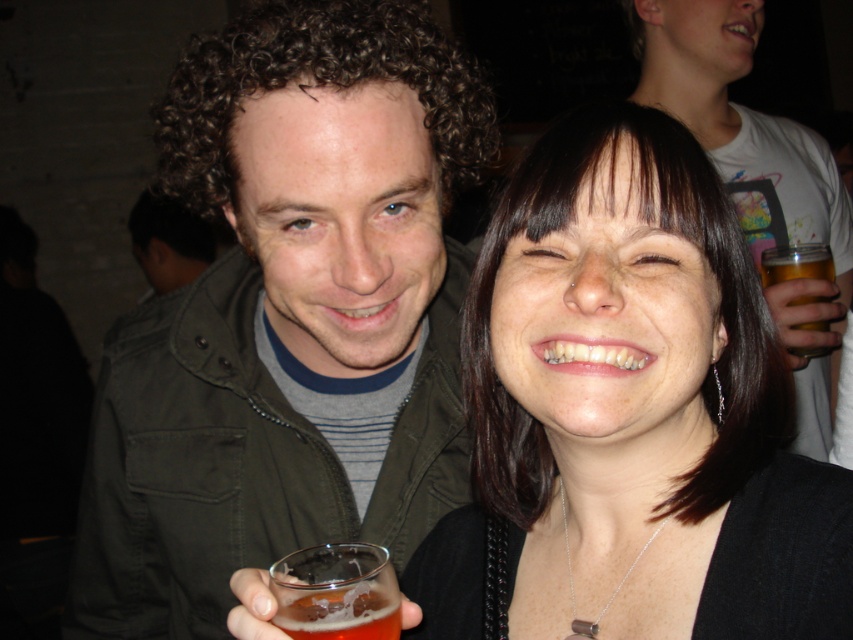
Question: Is matte gray jacket at center to the right of golden amber liquid at upper right from the viewer's perspective?

Choices:
 (A) yes
 (B) no

Answer: (A)

Question: Which point appears farthest from the camera in this image?

Choices:
 (A) (485, 413)
 (B) (136, 573)
 (C) (790, 272)

Answer: (C)

Question: Does matte green jacket at center have a greater width compared to translucent glass at lower center?

Choices:
 (A) yes
 (B) no

Answer: (A)

Question: Does matte green jacket at center have a smaller size compared to matte black hair at center?

Choices:
 (A) no
 (B) yes

Answer: (A)

Question: Which of the following is the farthest from the observer?

Choices:
 (A) matte black hair at center
 (B) matte green jacket at center
 (C) matte gray jacket at center
 (D) translucent glass at lower center

Answer: (C)

Question: Which of the following is the farthest from the observer?

Choices:
 (A) (802, 262)
 (B) (375, 621)

Answer: (A)